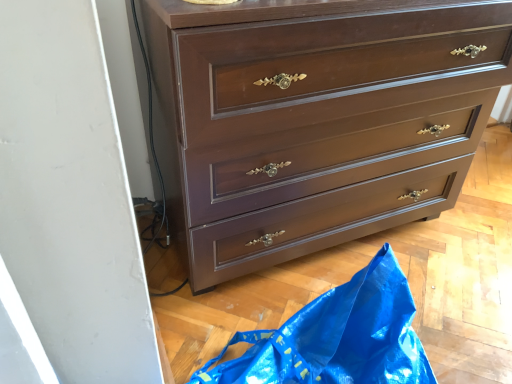
Locate an element on the screen. The height and width of the screenshot is (384, 512). matte brown dresser at center is located at coordinates (319, 124).

What is the approximate width of matte brown dresser at center?

19.52 inches.

Describe the element at coordinates (319, 124) in the screenshot. The width and height of the screenshot is (512, 384). I see `matte brown dresser at center` at that location.

You are a GUI agent. You are given a task and a screenshot of the screen. Output one action in this format:
    pyautogui.click(x=<x>, y=<y>)
    Task: Click on the matte brown dresser at center
    The image size is (512, 384).
    Given the screenshot: What is the action you would take?
    pyautogui.click(x=319, y=124)